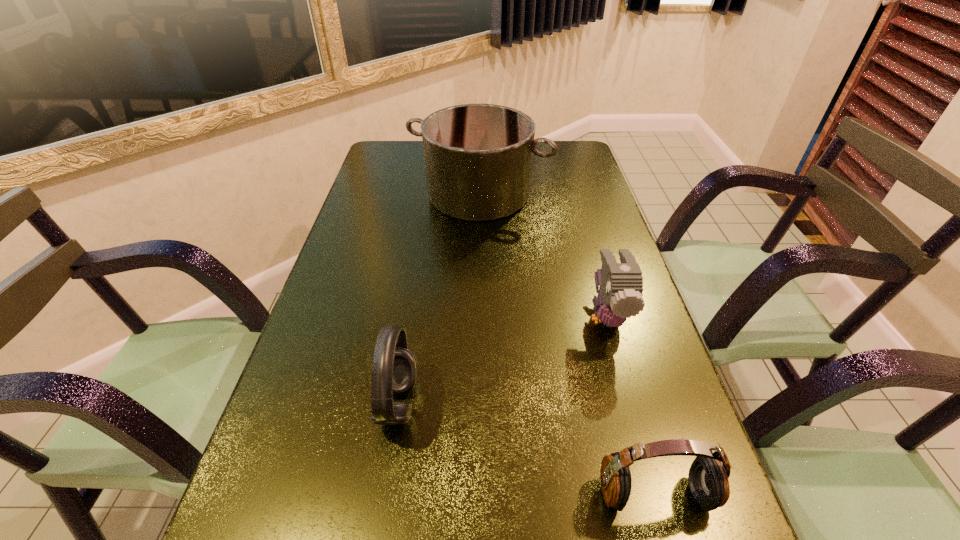
You are a GUI agent. You are given a task and a screenshot of the screen. Output one action in this format:
    pyautogui.click(x=<x>, y=<y>)
    Task: Click on the headset that is the second nearest to the pan
    
    Given the screenshot: What is the action you would take?
    pyautogui.click(x=708, y=475)

This screenshot has height=540, width=960. I want to click on headset identified as the second closest to the tallest object, so click(x=708, y=475).

Identify the location of free location that satisfies the following two spatial constraints: 1. at the beak of the bird; 2. on the earcups of the farther headset. (632, 403).

Where is `vacant area in the image that satisfies the following two spatial constraints: 1. at the beak of the bird; 2. on the earcups of the left headset`? vacant area in the image that satisfies the following two spatial constraints: 1. at the beak of the bird; 2. on the earcups of the left headset is located at coordinates (632, 403).

This screenshot has width=960, height=540. Identify the location of free space that satisfies the following two spatial constraints: 1. at the beak of the bird; 2. on the earcups of the farther headset. (632, 403).